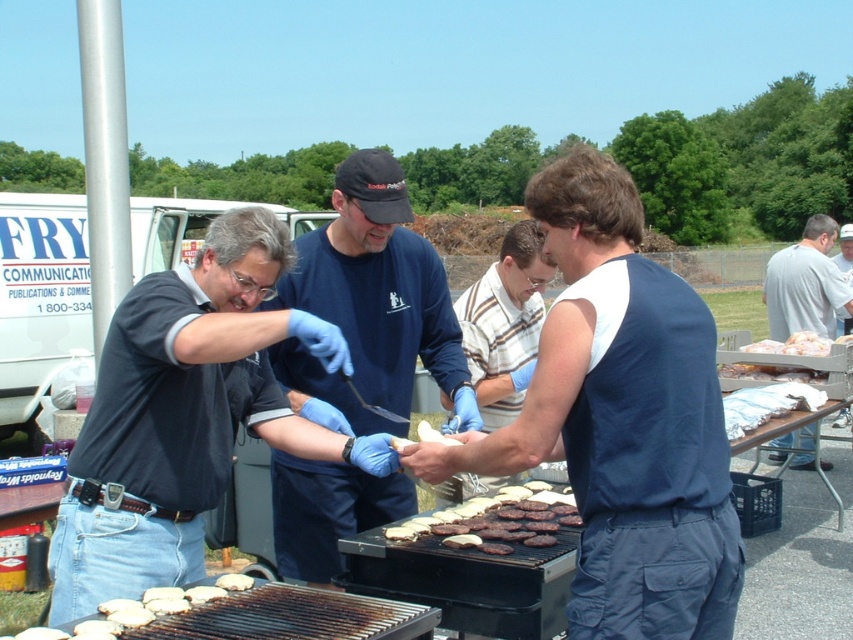
You are a photographer positioned behind the grill. You want to take a photo that includes both the blue cotton shirt at center and the gray cotton shirt at right. Which shirt will appear larger in the photo?

The blue cotton shirt at center will appear larger in the photo because it is closer to the viewer than the gray cotton shirt at right.

You are a photographer at the barbecue event. You want to take a photo of the two men wearing the dark blue shirt at center and blue cotton shirt at center. Which one should you focus on first if you want to capture the tallest person in the frame?

The blue cotton shirt at center is taller than the dark blue shirt at center, so you should focus on the blue cotton shirt at center first to capture the tallest person in the frame.